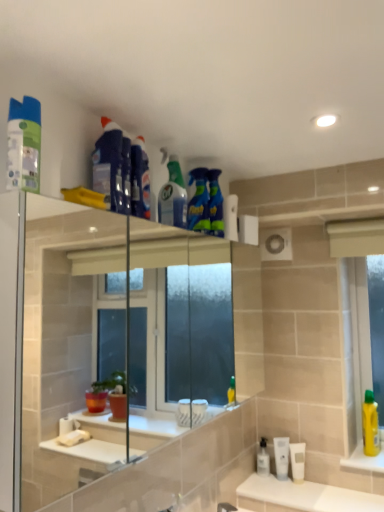
This screenshot has height=512, width=384. What do you see at coordinates (24, 145) in the screenshot? I see `matte plastic spray can at upper left, which ranks as the first cleaning product in front-to-back order` at bounding box center [24, 145].

The image size is (384, 512). In order to click on clear plastic faucet at lower center in this screenshot , I will do `click(173, 504)`.

This screenshot has width=384, height=512. What do you see at coordinates (199, 202) in the screenshot? I see `blue glossy spray bottle at upper center, which ranks as the second cleaning product in back-to-front order` at bounding box center [199, 202].

This screenshot has width=384, height=512. Describe the element at coordinates (263, 458) in the screenshot. I see `transparent plastic mouthwash at lower center, placed as the first mouthwash when sorted from left to right` at that location.

Where is `matte plastic spray can at upper left, the sixth cleaning product when ordered from right to left`? Image resolution: width=384 pixels, height=512 pixels. matte plastic spray can at upper left, the sixth cleaning product when ordered from right to left is located at coordinates (24, 145).

Is matte plastic spray can at upper left, the 6th cleaning product from the back, surrounded by translucent green spray bottle at upper center, which is counted as the fourth cleaning product, starting from the left?

No.

From the picture: Does translucent green spray bottle at upper center, the 3th cleaning product viewed from the right, turn towards matte plastic spray can at upper left, which ranks as the first cleaning product in front-to-back order?

No, translucent green spray bottle at upper center, the 3th cleaning product viewed from the right, is not turned towards matte plastic spray can at upper left, which ranks as the first cleaning product in front-to-back order.

Visually, is translucent green spray bottle at upper center, the fourth cleaning product in the front-to-back sequence, positioned to the left or to the right of matte plastic spray can at upper left, the sixth cleaning product when ordered from right to left?

From the image, it's evident that translucent green spray bottle at upper center, the fourth cleaning product in the front-to-back sequence, is to the right of matte plastic spray can at upper left, the sixth cleaning product when ordered from right to left.

This screenshot has width=384, height=512. Find the location of `the 1st cleaning product in front of the white glossy countertop at lower center, counting from the anchor's position`. the 1st cleaning product in front of the white glossy countertop at lower center, counting from the anchor's position is located at coordinates (173, 197).

Consider the image. What's the angular difference between translucent green spray bottle at upper center, which ranks as the 3th cleaning product in back-to-front order, and white glossy countertop at lower center's facing directions?

The angular difference between translucent green spray bottle at upper center, which ranks as the 3th cleaning product in back-to-front order, and white glossy countertop at lower center is 82 degrees.

Who is taller, translucent green spray bottle at upper center, the 3th cleaning product viewed from the right, or white glossy countertop at lower center?

Standing taller between the two is translucent green spray bottle at upper center, the 3th cleaning product viewed from the right.

Can you confirm if translucent green spray bottle at upper center, which is counted as the fourth cleaning product, starting from the left, is wider than white glossy countertop at lower center?

No, translucent green spray bottle at upper center, which is counted as the fourth cleaning product, starting from the left, is not wider than white glossy countertop at lower center.

Between blue glossy spray bottle at upper center, which ranks as the fourth cleaning product in back-to-front order, and blue glossy spray bottle at upper center, positioned as the sixth cleaning product in front-to-back order, which one has more height?

blue glossy spray bottle at upper center, positioned as the sixth cleaning product in front-to-back order.

Identify the location of the 3rd cleaning product to the left when counting from the blue glossy spray bottle at upper center, positioned as the sixth cleaning product in front-to-back order. (140, 180).

Can we say blue glossy spray bottle at upper center, which appears as the 3th cleaning product when viewed from the front, lies outside blue glossy spray bottle at upper center, which ranks as the 1th cleaning product in back-to-front order?

blue glossy spray bottle at upper center, which appears as the 3th cleaning product when viewed from the front, lies outside blue glossy spray bottle at upper center, which ranks as the 1th cleaning product in back-to-front order,'s area.

From a real-world perspective, is transparent plastic mouthwash at lower center, which is the third mouthwash from right to left, above or below blue glossy spray bottle at upper center, which ranks as the 1th cleaning product in back-to-front order?

transparent plastic mouthwash at lower center, which is the third mouthwash from right to left, is below blue glossy spray bottle at upper center, which ranks as the 1th cleaning product in back-to-front order.

Starting from the blue glossy spray bottle at upper center, marked as the 1th cleaning product in a right-to-left arrangement, which mouthwash is the 1st one to the right? Please provide its 2D coordinates.

[(263, 458)]

Is blue glossy spray bottle at upper center, which is counted as the 6th cleaning product, starting from the left, surrounded by transparent plastic mouthwash at lower center, placed as the first mouthwash when sorted from left to right?

Actually, blue glossy spray bottle at upper center, which is counted as the 6th cleaning product, starting from the left, is outside transparent plastic mouthwash at lower center, placed as the first mouthwash when sorted from left to right.

Does matte plastic spray can at upper left, which ranks as the first cleaning product in front-to-back order, have a lesser width compared to white matte tube at lower right, which is counted as the second mouthwash, starting from the right?

Incorrect, the width of matte plastic spray can at upper left, which ranks as the first cleaning product in front-to-back order, is not less than that of white matte tube at lower right, which is counted as the second mouthwash, starting from the right.

Starting from the white matte tube at lower right, which is counted as the second mouthwash, starting from the right, which cleaning product is the 6th one to the left? Please provide its 2D coordinates.

[(24, 145)]

Is matte plastic spray can at upper left, which ranks as the first cleaning product in front-to-back order, next to white matte tube at lower right, which is counted as the second mouthwash, starting from the right?

They are not placed beside each other.

Which is farther from the camera, (37, 176) or (280, 461)?

Point (280, 461)

Is matte plastic spray can at upper left, which ranks as the first cleaning product in front-to-back order, oriented away from blue glossy spray bottle at upper center, which appears as the 3th cleaning product when viewed from the front?

No, matte plastic spray can at upper left, which ranks as the first cleaning product in front-to-back order, is not facing away from blue glossy spray bottle at upper center, which appears as the 3th cleaning product when viewed from the front.

Considering the sizes of objects matte plastic spray can at upper left, the sixth cleaning product when ordered from right to left, and blue glossy spray bottle at upper center, placed as the 4th cleaning product when sorted from right to left, in the image provided, who is thinner, matte plastic spray can at upper left, the sixth cleaning product when ordered from right to left, or blue glossy spray bottle at upper center, placed as the 4th cleaning product when sorted from right to left,?

Thinner between the two is blue glossy spray bottle at upper center, placed as the 4th cleaning product when sorted from right to left.

Does matte plastic spray can at upper left, the sixth cleaning product when ordered from right to left, lie behind blue glossy spray bottle at upper center, placed as the 4th cleaning product when sorted from right to left?

No.

From the image's perspective, is matte plastic spray can at upper left, which ranks as the first cleaning product in front-to-back order, on top of blue glossy spray bottle at upper center, which ranks as the fourth cleaning product in back-to-front order?

Yes, from the image's perspective, matte plastic spray can at upper left, which ranks as the first cleaning product in front-to-back order, is above blue glossy spray bottle at upper center, which ranks as the fourth cleaning product in back-to-front order.

Is blue glossy cleaner at upper left, which appears as the fifth cleaning product when viewed from the right, turned away from clear plastic faucet at lower center?

No, clear plastic faucet at lower center is not at the back of blue glossy cleaner at upper left, which appears as the fifth cleaning product when viewed from the right.

Looking at this image, is blue glossy cleaner at upper left, marked as the 2th cleaning product in a left-to-right arrangement, completely or partially outside of clear plastic faucet at lower center?

Yes, blue glossy cleaner at upper left, marked as the 2th cleaning product in a left-to-right arrangement, is located beyond the bounds of clear plastic faucet at lower center.

From the image's perspective, is blue glossy cleaner at upper left, the second cleaning product viewed from the front, above clear plastic faucet at lower center?

Yes, from the image's perspective, blue glossy cleaner at upper left, the second cleaning product viewed from the front, is over clear plastic faucet at lower center.

Between blue glossy cleaner at upper left, marked as the fifth cleaning product in a back-to-front arrangement, and clear plastic faucet at lower center, which one has larger width?

blue glossy cleaner at upper left, marked as the fifth cleaning product in a back-to-front arrangement, is wider.

I want to click on cleaning product that is the 3rd object located in front of the translucent green spray bottle at upper center, the 3th cleaning product viewed from the right, so click(24, 145).

From a real-world perspective, starting from the white glossy countertop at lower center, which cleaning product is the 5th one vertically above it? Please provide its 2D coordinates.

[(173, 197)]

From the image, which object appears to be nearer to white glossy countertop at lower center, translucent green spray bottle at upper center, which is counted as the fourth cleaning product, starting from the left, or white matte tube at lower right, marked as the 2th mouthwash in a left-to-right arrangement?

Among the two, white matte tube at lower right, marked as the 2th mouthwash in a left-to-right arrangement, is located nearer to white glossy countertop at lower center.

Considering their positions, is blue glossy cleaner at upper left, marked as the fifth cleaning product in a back-to-front arrangement, positioned closer to transparent plastic mouthwash at lower center, placed as the first mouthwash when sorted from left to right, than blue glossy spray bottle at upper center, placed as the 4th cleaning product when sorted from right to left?

Based on the image, blue glossy spray bottle at upper center, placed as the 4th cleaning product when sorted from right to left, appears to be nearer to transparent plastic mouthwash at lower center, placed as the first mouthwash when sorted from left to right.

When comparing their distances from translucent green spray bottle at upper center, the fourth cleaning product in the front-to-back sequence, does blue glossy cleaner at upper left, marked as the 2th cleaning product in a left-to-right arrangement, or blue glossy spray bottle at upper center, which appears as the 3th cleaning product when viewed from the front, seem closer?

blue glossy spray bottle at upper center, which appears as the 3th cleaning product when viewed from the front, is positioned closer to the anchor translucent green spray bottle at upper center, the fourth cleaning product in the front-to-back sequence.

Based on their spatial positions, is transparent plastic mouthwash at lower center, placed as the first mouthwash when sorted from left to right, or white glossy sink at lower center further from white matte tube at lower right, marked as the 2th mouthwash in a left-to-right arrangement?

The object further to white matte tube at lower right, marked as the 2th mouthwash in a left-to-right arrangement, is white glossy sink at lower center.

From the image, which object appears to be nearer to matte plastic spray can at upper left, the 6th cleaning product from the back, transparent plastic mouthwash at lower center, which is the third mouthwash from right to left, or blue glossy spray bottle at upper center, positioned as the 2th cleaning product in right-to-left order?

Among the two, blue glossy spray bottle at upper center, positioned as the 2th cleaning product in right-to-left order, is located nearer to matte plastic spray can at upper left, the 6th cleaning product from the back.

Which object lies further to the anchor point blue glossy spray bottle at upper center, positioned as the 2th cleaning product in right-to-left order, blue glossy spray bottle at upper center, which appears as the 3th cleaning product when viewed from the front, or white matte tube at lower right, which is counted as the second mouthwash, starting from the right?

white matte tube at lower right, which is counted as the second mouthwash, starting from the right.

Which object lies further to the anchor point white matte tube at lower center, the 3th mouthwash in the left-to-right sequence, white glossy sink at lower center or clear plastic faucet at lower center?

clear plastic faucet at lower center is positioned further to the anchor white matte tube at lower center, the 3th mouthwash in the left-to-right sequence.

Estimate the real-world distances between objects in this image. Which object is further from white glossy sink at lower center, white matte tube at lower center, the 3th mouthwash in the left-to-right sequence, or blue glossy cleaner at upper left, marked as the 2th cleaning product in a left-to-right arrangement?

Based on the image, blue glossy cleaner at upper left, marked as the 2th cleaning product in a left-to-right arrangement, appears to be further to white glossy sink at lower center.

You are a GUI agent. You are given a task and a screenshot of the screen. Output one action in this format:
    pyautogui.click(x=<x>, y=<y>)
    Task: Click on the counter top between white glossy sink at lower center and white matte tube at lower center, arranged as the first mouthwash when viewed from the right, along the z-axis
    The height and width of the screenshot is (512, 384).
    Given the screenshot: What is the action you would take?
    pyautogui.click(x=302, y=496)

Where is `faucet between blue glossy spray bottle at upper center, the fifth cleaning product when ordered from front to back, and white matte tube at lower center, arranged as the first mouthwash when viewed from the right, in the up-down direction`? The width and height of the screenshot is (384, 512). faucet between blue glossy spray bottle at upper center, the fifth cleaning product when ordered from front to back, and white matte tube at lower center, arranged as the first mouthwash when viewed from the right, in the up-down direction is located at coordinates (173, 504).

The height and width of the screenshot is (512, 384). Identify the location of counter top between blue glossy spray bottle at upper center, which ranks as the fourth cleaning product in back-to-front order, and white glossy sink at lower center in the up-down direction. (302, 496).

Image resolution: width=384 pixels, height=512 pixels. I want to click on cleaning product between blue glossy spray bottle at upper center, the fifth cleaning product when ordered from front to back, and clear plastic faucet at lower center in the up-down direction, so click(x=215, y=204).